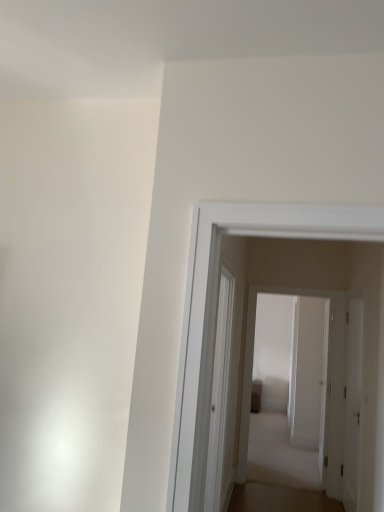
Question: Is white glossy door at center, which appears as the 1th door when viewed from the back, looking in the opposite direction of transparent glass door at center?

Choices:
 (A) yes
 (B) no

Answer: (B)

Question: Is white glossy door at center, acting as the 2th door starting from the front, positioned before transparent glass door at center?

Choices:
 (A) yes
 (B) no

Answer: (B)

Question: Can you confirm if white glossy door at center, acting as the 2th door starting from the front, is bigger than transparent glass door at center?

Choices:
 (A) no
 (B) yes

Answer: (A)

Question: Is white glossy door at center, which appears as the 1th door when viewed from the back, not near transparent glass door at center?

Choices:
 (A) yes
 (B) no

Answer: (A)

Question: Does white glossy door at center, acting as the 2th door starting from the front, have a greater height compared to transparent glass door at center?

Choices:
 (A) no
 (B) yes

Answer: (B)

Question: Is transparent glass door at center bigger or smaller than white matte door at right, which is the first door from front to back?

Choices:
 (A) big
 (B) small

Answer: (A)

Question: From a real-world perspective, is transparent glass door at center positioned above or below white matte door at right, positioned as the 2th door in back-to-front order?

Choices:
 (A) below
 (B) above

Answer: (B)

Question: Do you think transparent glass door at center is within white matte door at right, which is the first door from front to back, or outside of it?

Choices:
 (A) outside
 (B) inside

Answer: (A)

Question: Considering their positions, is transparent glass door at center located in front of or behind white matte door at right, which is the first door from front to back?

Choices:
 (A) behind
 (B) front

Answer: (B)

Question: Is white matte door at right, which is the first door from front to back, in front of or behind white glossy door at center, which appears as the 1th door when viewed from the back, in the image?

Choices:
 (A) behind
 (B) front

Answer: (B)

Question: Considering the positions of point (350, 489) and point (337, 348), is point (350, 489) closer or farther from the camera than point (337, 348)?

Choices:
 (A) closer
 (B) farther

Answer: (A)

Question: From a real-world perspective, is white matte door at right, which is the first door from front to back, positioned above or below white glossy door at center, which appears as the 1th door when viewed from the back?

Choices:
 (A) below
 (B) above

Answer: (A)

Question: Considering the positions of white matte door at right, which is the first door from front to back, and white glossy door at center, acting as the 2th door starting from the front, in the image, is white matte door at right, which is the first door from front to back, wider or thinner than white glossy door at center, acting as the 2th door starting from the front,?

Choices:
 (A) thin
 (B) wide

Answer: (A)

Question: Is white glossy door at center, which appears as the 1th door when viewed from the back, taller or shorter than white matte door at right, positioned as the 2th door in back-to-front order?

Choices:
 (A) tall
 (B) short

Answer: (A)

Question: Considering the positions of white glossy door at center, acting as the 2th door starting from the front, and white matte door at right, positioned as the 2th door in back-to-front order, in the image, is white glossy door at center, acting as the 2th door starting from the front, wider or thinner than white matte door at right, positioned as the 2th door in back-to-front order,?

Choices:
 (A) thin
 (B) wide

Answer: (B)